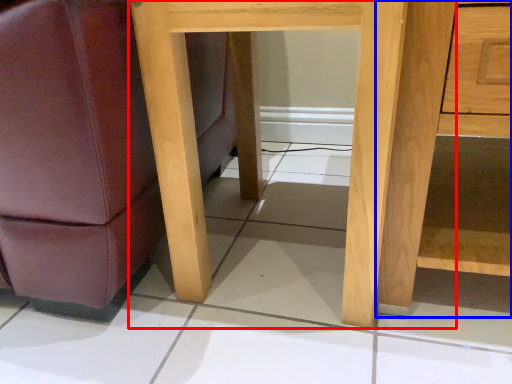
Question: Among these objects, which one is nearest to the camera, table (highlighted by a red box) or dresser (highlighted by a blue box)?

Choices:
 (A) table
 (B) dresser

Answer: (B)